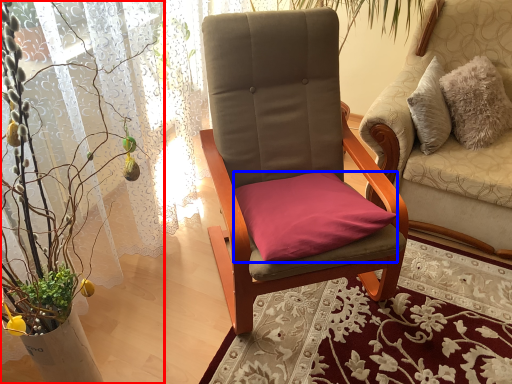
Question: Among these objects, which one is farthest to the camera, houseplant (highlighted by a red box) or pillow (highlighted by a blue box)?

Choices:
 (A) houseplant
 (B) pillow

Answer: (B)